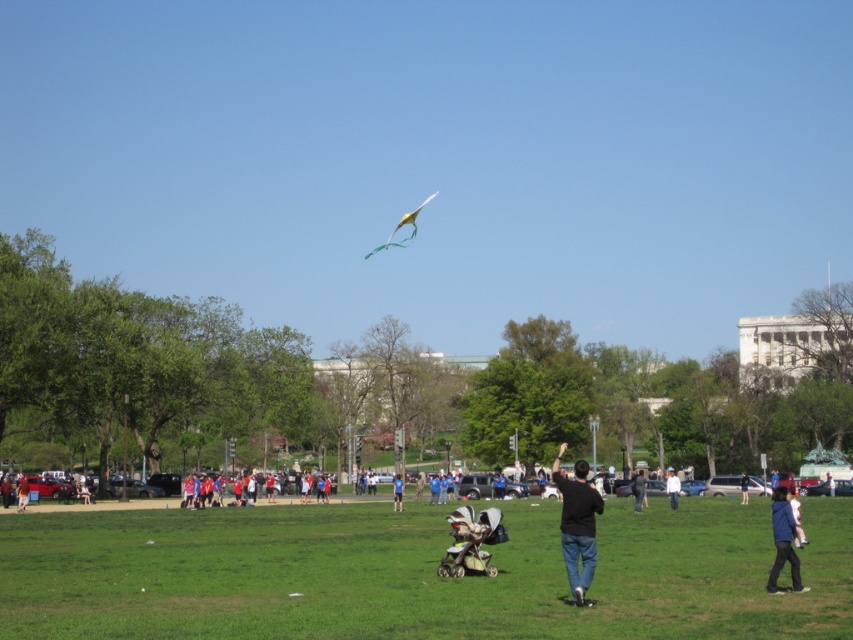
Question: Which object is positioned closest to the blue fabric jacket at lower right?

Choices:
 (A) black cotton jacket at center
 (B) black matte shirt at center

Answer: (B)

Question: Is yellow paper kite at upper center above red shirt at lower left?

Choices:
 (A) yes
 (B) no

Answer: (A)

Question: Can you confirm if blue fabric jacket at lower right is wider than white matte shirt at center?

Choices:
 (A) yes
 (B) no

Answer: (B)

Question: Is green grass at center further to camera compared to yellow paper kite at upper center?

Choices:
 (A) yes
 (B) no

Answer: (B)

Question: Which point is closer to the camera?

Choices:
 (A) black matte shirt at center
 (B) yellow paper kite at upper center
 (C) red shirt at lower left
 (D) solid red shirt at center

Answer: (A)

Question: Among these objects, which one is farthest from the camera?

Choices:
 (A) dark blue shirt at center
 (B) white matte shirt at center
 (C) black matte shirt at center

Answer: (B)